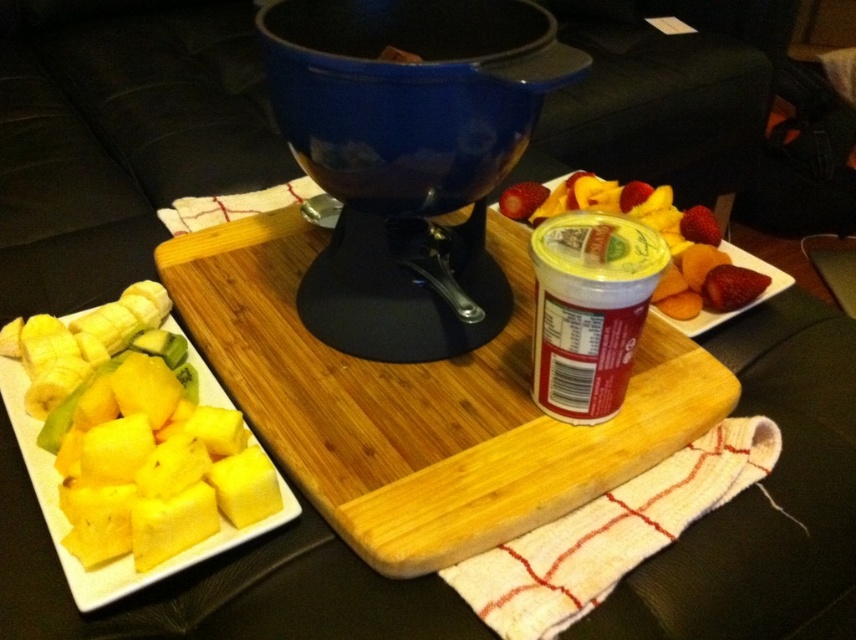
You are preparing to serve a dessert fondue and need to place both the wooden cutting board at center and the white creamy yogurt at center on the table. Given that the table has limited space, which item should you place first to ensure both fit properly?

The wooden cutting board at center is bigger than the white creamy yogurt at center, so you should place the wooden cutting board at center first to ensure there is enough space for both items.

You are at a fondue party and want to grab a fruit from the nearest plate. The yellow matte pineapple at center and the red matte strawberry at center are both on plates. Which fruit is closer to you?

Result: The yellow matte pineapple at center is closer to you because it is in front of the red matte strawberry at center.